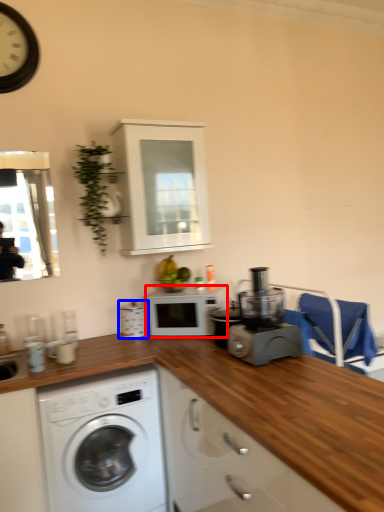
Question: Which object appears farthest to the camera in this image, microwave oven (highlighted by a red box) or appliance (highlighted by a blue box)?

Choices:
 (A) microwave oven
 (B) appliance

Answer: (B)